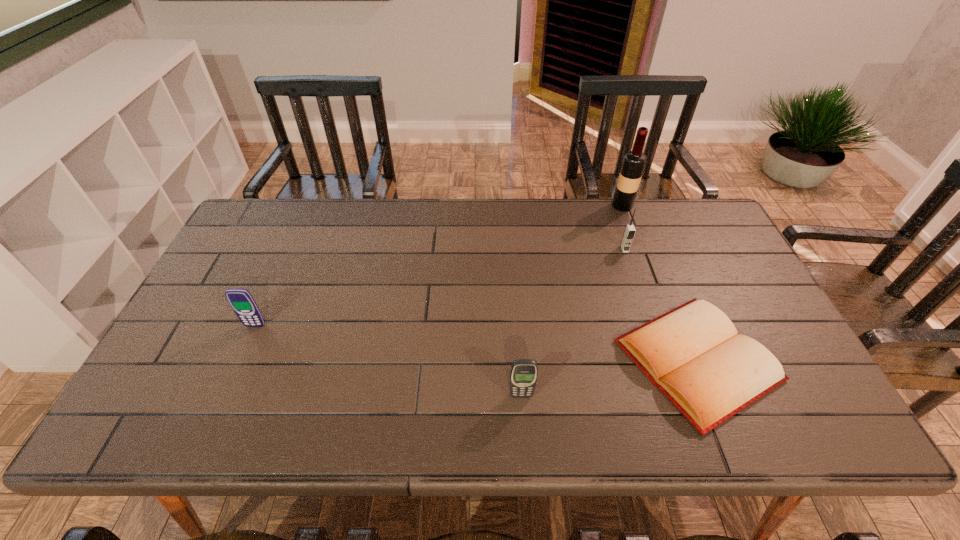
At what (x,y) coordinates should I click in order to perform the action: click on the tallest object. Please return your answer as a coordinate pair (x, y). The image size is (960, 540). Looking at the image, I should click on (634, 161).

I want to click on the farthest object, so click(x=634, y=161).

Image resolution: width=960 pixels, height=540 pixels. Find the location of `the rightmost cellular telephone`. the rightmost cellular telephone is located at coordinates (629, 232).

Identify the location of the fourth nearest object. The height and width of the screenshot is (540, 960). (629, 232).

You are a GUI agent. You are given a task and a screenshot of the screen. Output one action in this format:
    pyautogui.click(x=<x>, y=<y>)
    Task: Click on the leftmost object
    
    Given the screenshot: What is the action you would take?
    pos(241,301)

I want to click on the leftmost cellular telephone, so click(241, 301).

You are a GUI agent. You are given a task and a screenshot of the screen. Output one action in this format:
    pyautogui.click(x=<x>, y=<y>)
    Task: Click on the second cellular telephone from right to left
    This screenshot has width=960, height=540.
    Given the screenshot: What is the action you would take?
    pyautogui.click(x=523, y=376)

Locate an element on the screen. This screenshot has width=960, height=540. the fourth object from right to left is located at coordinates (523, 376).

This screenshot has height=540, width=960. In order to click on Bible in this screenshot , I will do `click(693, 354)`.

What are the coordinates of `free space located 0.390m on the front of the farthest object` in the screenshot? It's located at (x=657, y=299).